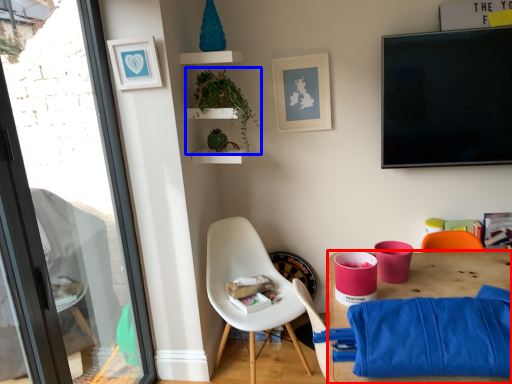
Question: Which object appears closest to the camera in this image, desk (highlighted by a red box) or houseplant (highlighted by a blue box)?

Choices:
 (A) desk
 (B) houseplant

Answer: (A)